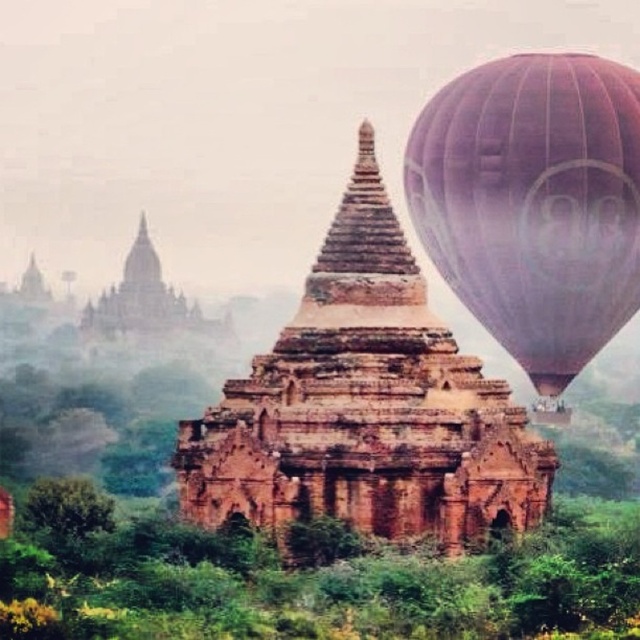
Question: Can you confirm if reddish-brown stone temple at center is smaller than matte purple balloon at upper right?

Choices:
 (A) no
 (B) yes

Answer: (A)

Question: Does reddish-brown stone temple at center appear on the right side of matte purple balloon at upper right?

Choices:
 (A) no
 (B) yes

Answer: (A)

Question: Is reddish-brown stone temple at center smaller than matte purple balloon at upper right?

Choices:
 (A) no
 (B) yes

Answer: (A)

Question: Which point is farther to the camera?

Choices:
 (A) reddish-brown stone temple at center
 (B) matte purple balloon at upper right

Answer: (B)

Question: Which point is closer to the camera?

Choices:
 (A) matte purple balloon at upper right
 (B) reddish-brown stone temple at center

Answer: (B)